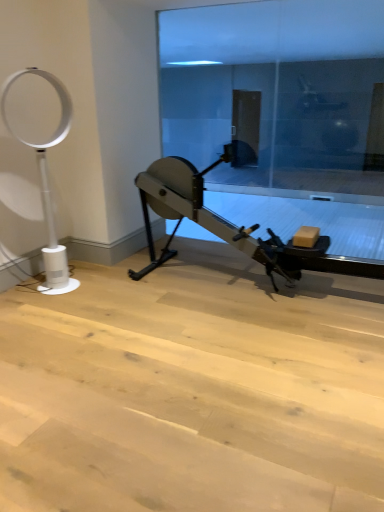
Where is `free location in front of metallic gray stationary bicycle at center`? Image resolution: width=384 pixels, height=512 pixels. free location in front of metallic gray stationary bicycle at center is located at coordinates (232, 372).